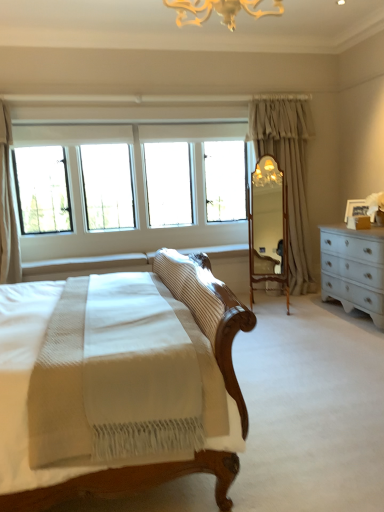
You are a GUI agent. You are given a task and a screenshot of the screen. Output one action in this format:
    pyautogui.click(x=<x>, y=<y>)
    Task: Click on the wooden mirror at center
    Image resolution: width=384 pixels, height=512 pixels.
    Given the screenshot: What is the action you would take?
    pyautogui.click(x=268, y=226)

This screenshot has height=512, width=384. What do you see at coordinates (7, 208) in the screenshot? I see `white textured curtain at upper left, the first curtain viewed from the left` at bounding box center [7, 208].

Where is `clear glass windows at upper left`? The width and height of the screenshot is (384, 512). clear glass windows at upper left is located at coordinates (136, 172).

Where is `wooden mirror at center`? Image resolution: width=384 pixels, height=512 pixels. wooden mirror at center is located at coordinates (268, 226).

Are white textured curtain at upper left, the second curtain viewed from the back, and clear glass windows at upper left located far from each other?

Yes, white textured curtain at upper left, the second curtain viewed from the back, and clear glass windows at upper left are quite far apart.

Is clear glass windows at upper left surrounded by white textured curtain at upper left, the first curtain viewed from the left?

No, white textured curtain at upper left, the first curtain viewed from the left, does not contain clear glass windows at upper left.

Considering the positions of objects white textured curtain at upper left, the second curtain viewed from the back, and clear glass windows at upper left in the image provided, who is more to the left, white textured curtain at upper left, the second curtain viewed from the back, or clear glass windows at upper left?

Positioned to the left is white textured curtain at upper left, the second curtain viewed from the back.

Identify the location of window behind the white textured curtain at upper left, which is the second curtain from right to left. This screenshot has width=384, height=512. (136, 172).

Considering the points (82, 126) and (283, 273), which point is in front, point (82, 126) or point (283, 273)?

Positioned in front is point (283, 273).

The height and width of the screenshot is (512, 384). Find the location of `mirror on the right of clear glass windows at upper left`. mirror on the right of clear glass windows at upper left is located at coordinates (268, 226).

From a real-world perspective, is clear glass windows at upper left located higher than wooden mirror at center?

Indeed, from a real-world perspective, clear glass windows at upper left stands above wooden mirror at center.

Would you say wooden mirror at center contains white textured curtain at upper left, which is the second curtain from right to left?

No.

Measure the distance between wooden mirror at center and white textured curtain at upper left, the second curtain viewed from the back.

wooden mirror at center and white textured curtain at upper left, the second curtain viewed from the back, are 2.58 meters apart from each other.

Is point (259, 160) positioned behind point (18, 247)?

That is True.

Considering the positions of objects wooden mirror at center and white textured curtain at upper left, which is the second curtain from right to left, in the image provided, who is more to the right, wooden mirror at center or white textured curtain at upper left, which is the second curtain from right to left,?

From the viewer's perspective, wooden mirror at center appears more on the right side.

Considering the relative sizes of white textured curtain at upper left, the first curtain viewed from the left, and light beige fabric curtain at center-right, placed as the second curtain when sorted from left to right, in the image provided, is white textured curtain at upper left, the first curtain viewed from the left, taller than light beige fabric curtain at center-right, placed as the second curtain when sorted from left to right,?

In fact, white textured curtain at upper left, the first curtain viewed from the left, may be shorter than light beige fabric curtain at center-right, placed as the second curtain when sorted from left to right.

Is white textured curtain at upper left, the first curtain from the front, smaller than light beige fabric curtain at center-right, placed as the second curtain when sorted from left to right?

Yes, white textured curtain at upper left, the first curtain from the front, is smaller than light beige fabric curtain at center-right, placed as the second curtain when sorted from left to right.

How much distance is there between light beige fabric curtain at center-right, placed as the second curtain when sorted from left to right, and clear glass windows at upper left?

light beige fabric curtain at center-right, placed as the second curtain when sorted from left to right, is 1.04 meters from clear glass windows at upper left.

Does point (296, 291) come behind point (135, 234)?

No, it is not.

Considering the positions of objects light beige fabric curtain at center-right, the 1th curtain in the right-to-left sequence, and clear glass windows at upper left in the image provided, who is more to the right, light beige fabric curtain at center-right, the 1th curtain in the right-to-left sequence, or clear glass windows at upper left?

From the viewer's perspective, light beige fabric curtain at center-right, the 1th curtain in the right-to-left sequence, appears more on the right side.

Is light beige fabric curtain at center-right, which ranks as the 2th curtain in front-to-back order, facing away from clear glass windows at upper left?

No, clear glass windows at upper left is not at the back of light beige fabric curtain at center-right, which ranks as the 2th curtain in front-to-back order.

Can you tell me how much light beige fabric curtain at center-right, which ranks as the 2th curtain in front-to-back order, and wooden mirror at center differ in facing direction?

The facing directions of light beige fabric curtain at center-right, which ranks as the 2th curtain in front-to-back order, and wooden mirror at center are 64.4 degrees apart.

Is light beige fabric curtain at center-right, the 1th curtain positioned from the back, next to wooden mirror at center and touching it?

No, light beige fabric curtain at center-right, the 1th curtain positioned from the back, is not making contact with wooden mirror at center.

Between light beige fabric curtain at center-right, the 1th curtain in the right-to-left sequence, and wooden mirror at center, which one has less height?

wooden mirror at center is shorter.

Between point (286, 176) and point (266, 176), which one is positioned behind?

Positioned behind is point (286, 176).

Consider the image. Can you tell me how much clear glass windows at upper left and white textured curtain at upper left, the first curtain from the front, differ in facing direction?

The angular difference between clear glass windows at upper left and white textured curtain at upper left, the first curtain from the front, is 0.506 degrees.

Is white textured curtain at upper left, the first curtain viewed from the left, inside clear glass windows at upper left?

No.

Does clear glass windows at upper left have a lesser width compared to white textured curtain at upper left, the first curtain viewed from the left?

Incorrect, the width of clear glass windows at upper left is not less than that of white textured curtain at upper left, the first curtain viewed from the left.

Which is behind, point (53, 126) or point (6, 249)?

The point (53, 126) is more distant.

This screenshot has width=384, height=512. I want to click on the 2nd curtain below the clear glass windows at upper left (from the image's perspective), so click(7, 208).

At what (x,y) coordinates should I click in order to perform the action: click on window lying on the left of wooden mirror at center. Please return your answer as a coordinate pair (x, y). The height and width of the screenshot is (512, 384). Looking at the image, I should click on (136, 172).

Based on the photo, from the image, which object appears to be farther from wooden mirror at center, light beige fabric curtain at center-right, the 1th curtain positioned from the back, or white textured curtain at upper left, the second curtain viewed from the back?

The object further to wooden mirror at center is white textured curtain at upper left, the second curtain viewed from the back.

Based on the photo, when comparing their distances from clear glass windows at upper left, does white textured curtain at upper left, the first curtain viewed from the left, or light beige fabric curtain at center-right, which ranks as the 2th curtain in front-to-back order, seem further?

Based on the image, white textured curtain at upper left, the first curtain viewed from the left, appears to be further to clear glass windows at upper left.

When comparing their distances from white textured curtain at upper left, the second curtain viewed from the back, does light beige fabric curtain at center-right, the 1th curtain positioned from the back, or clear glass windows at upper left seem closer?

The object closer to white textured curtain at upper left, the second curtain viewed from the back, is clear glass windows at upper left.

When comparing their distances from clear glass windows at upper left, does wooden mirror at center or white textured curtain at upper left, the second curtain viewed from the back, seem further?

wooden mirror at center.

Which object lies further to the anchor point white textured curtain at upper left, which is the second curtain from right to left, wooden mirror at center or clear glass windows at upper left?

wooden mirror at center is positioned further to the anchor white textured curtain at upper left, which is the second curtain from right to left.

From the image, which object appears to be nearer to white textured curtain at upper left, the second curtain viewed from the back, clear glass windows at upper left or wooden mirror at center?

clear glass windows at upper left.

Considering their positions, is clear glass windows at upper left positioned closer to wooden mirror at center than light beige fabric curtain at center-right, the 1th curtain in the right-to-left sequence?

light beige fabric curtain at center-right, the 1th curtain in the right-to-left sequence, is closer to wooden mirror at center.

Based on their spatial positions, is light beige fabric curtain at center-right, the 1th curtain in the right-to-left sequence, or clear glass windows at upper left closer to wooden mirror at center?

Based on the image, light beige fabric curtain at center-right, the 1th curtain in the right-to-left sequence, appears to be nearer to wooden mirror at center.

Find the location of `mirror between clear glass windows at upper left and light beige fabric curtain at center-right, which ranks as the 2th curtain in front-to-back order, from left to right`. mirror between clear glass windows at upper left and light beige fabric curtain at center-right, which ranks as the 2th curtain in front-to-back order, from left to right is located at coordinates (268, 226).

At what (x,y) coordinates should I click in order to perform the action: click on window located between white textured curtain at upper left, the first curtain from the front, and wooden mirror at center in the left-right direction. Please return your answer as a coordinate pair (x, y). This screenshot has width=384, height=512. Looking at the image, I should click on click(136, 172).

Identify the location of window between white textured curtain at upper left, the second curtain viewed from the back, and light beige fabric curtain at center-right, the 1th curtain positioned from the back, in the horizontal direction. (136, 172).

Identify the location of mirror located between white textured curtain at upper left, which is the second curtain from right to left, and light beige fabric curtain at center-right, which ranks as the 2th curtain in front-to-back order, in the left-right direction. Image resolution: width=384 pixels, height=512 pixels. (268, 226).